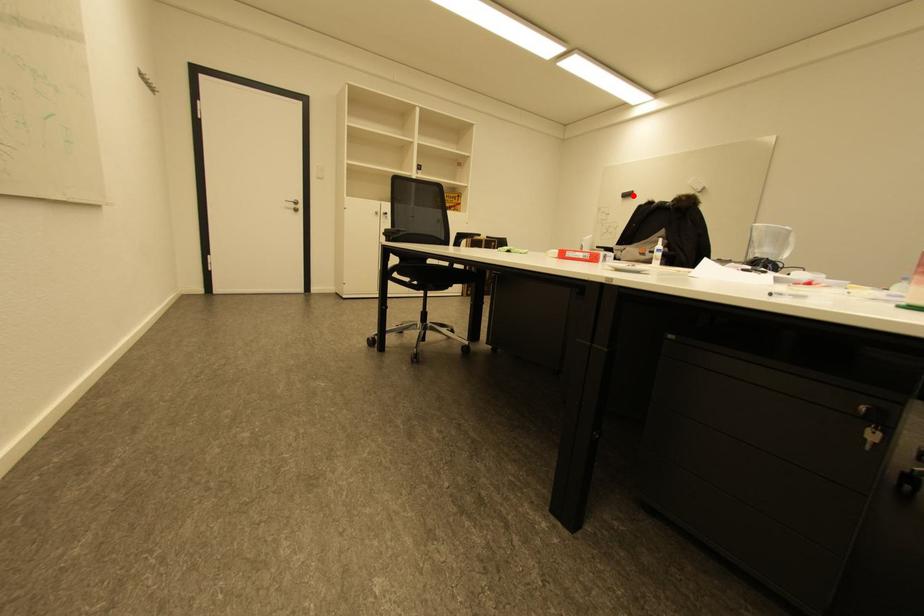
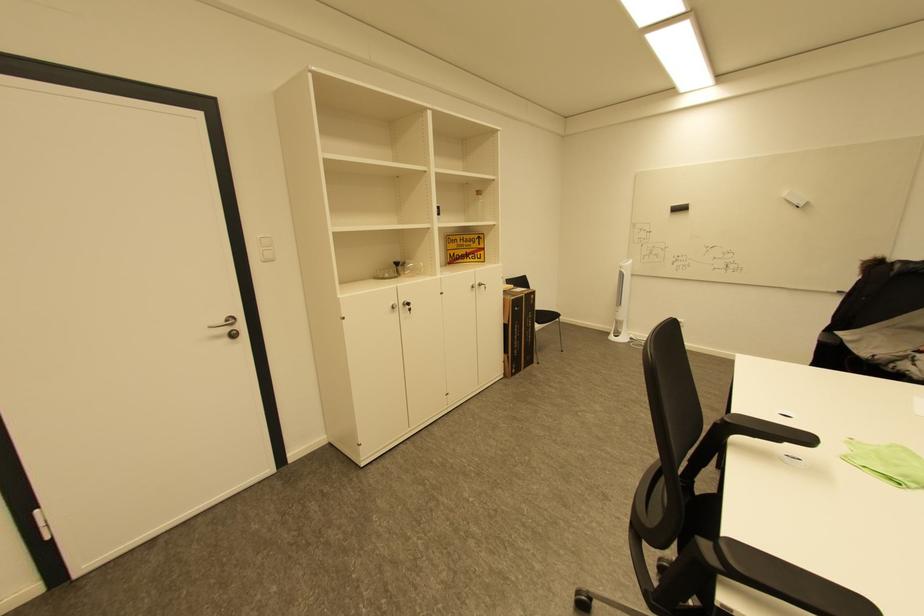
Locate, in the second image, the point that corresponds to the highlighted location in the first image.

(686, 209)